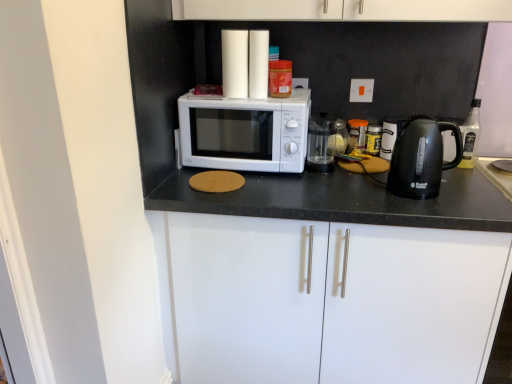
At what (x,y) coordinates should I click in order to perform the action: click on vacant space in front of black plastic bottle at right. Please return your answer as a coordinate pair (x, y). Image resolution: width=512 pixels, height=384 pixels. Looking at the image, I should click on (473, 178).